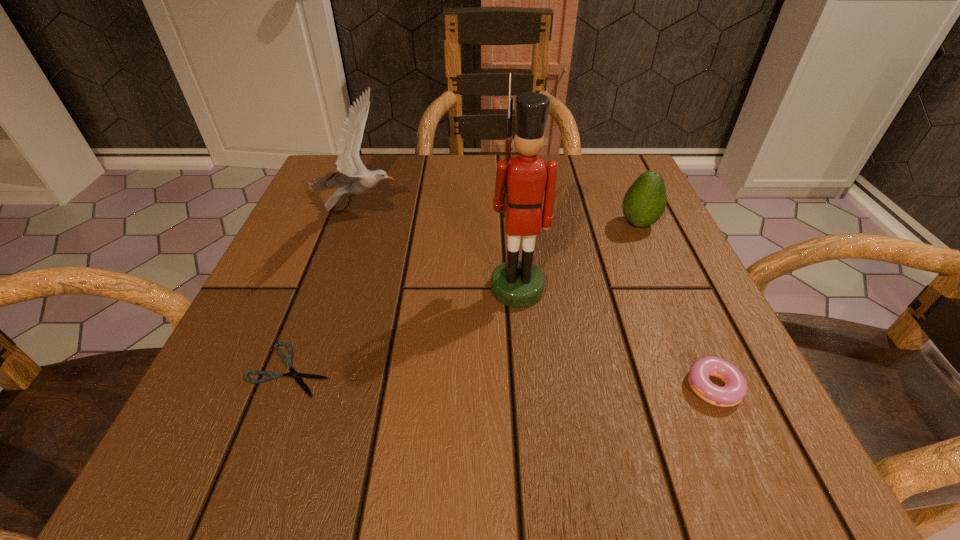
Find the location of a particular element. The width and height of the screenshot is (960, 540). blank space that satisfies the following two spatial constraints: 1. on the back side of the third tallest object; 2. at the tip of the beak of the gull is located at coordinates (633, 211).

Identify the location of blank space that satisfies the following two spatial constraints: 1. at the tip of the beak of the avocado; 2. on the right side of the fourth shortest object. (358, 224).

Find the location of a particular element. free space that satisfies the following two spatial constraints: 1. at the tip of the beak of the fourth shortest object; 2. on the left side of the doughnut is located at coordinates (302, 387).